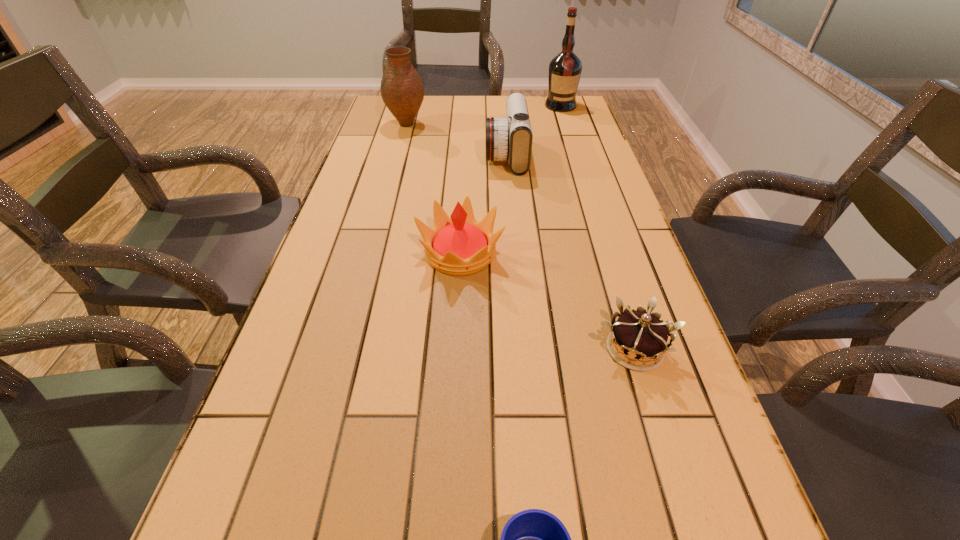
You are a GUI agent. You are given a task and a screenshot of the screen. Output one action in this format:
    pyautogui.click(x=<x>, y=<y>)
    Task: Click on the liquor
    This screenshot has width=960, height=540.
    Given the screenshot: What is the action you would take?
    pyautogui.click(x=565, y=69)

Find the location of a particular element. The image size is (960, 540). the tallest object is located at coordinates (565, 69).

Find the location of a particular element. This screenshot has height=540, width=960. the second tallest object is located at coordinates (402, 90).

Locate an element on the screen. the leftmost object is located at coordinates (402, 90).

Where is `camcorder`? The height and width of the screenshot is (540, 960). camcorder is located at coordinates (509, 138).

Where is `the left crown`? The width and height of the screenshot is (960, 540). the left crown is located at coordinates (460, 246).

Locate an element on the screen. This screenshot has width=960, height=540. the third nearest object is located at coordinates (460, 246).

Identify the location of the shorter crown. This screenshot has height=540, width=960. (642, 335).

Find the location of `the second nearest object`. the second nearest object is located at coordinates (642, 335).

This screenshot has width=960, height=540. What are the coordinates of `vacant region located on the surface of the tallest object` in the screenshot? It's located at (567, 127).